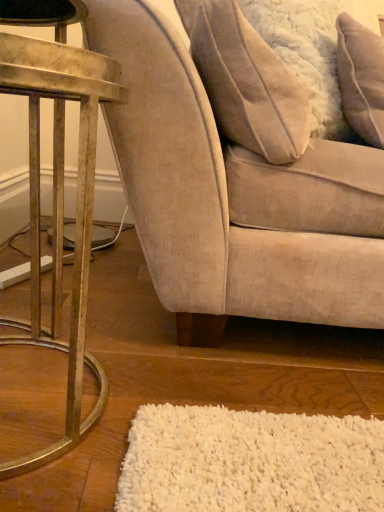
Question: Does white fluffy pillow at upper right, the second pillow from the left, have a larger size compared to beige fabric pillow at upper right, positioned as the 1th pillow in left-to-right order?

Choices:
 (A) yes
 (B) no

Answer: (B)

Question: Does white fluffy pillow at upper right, the second pillow from the left, have a lesser width compared to beige fabric pillow at upper right, which is counted as the 2th pillow, starting from the right?

Choices:
 (A) yes
 (B) no

Answer: (A)

Question: Is white fluffy pillow at upper right, the first pillow in the right-to-left sequence, smaller than beige fabric pillow at upper right, positioned as the 1th pillow in left-to-right order?

Choices:
 (A) yes
 (B) no

Answer: (A)

Question: Is white fluffy pillow at upper right, the second pillow from the left, behind beige fabric pillow at upper right, positioned as the 1th pillow in left-to-right order?

Choices:
 (A) no
 (B) yes

Answer: (B)

Question: Does white fluffy pillow at upper right, the first pillow in the right-to-left sequence, turn towards beige fabric pillow at upper right, which is counted as the 2th pillow, starting from the right?

Choices:
 (A) yes
 (B) no

Answer: (B)

Question: From a real-world perspective, relative to beige fabric pillow at upper right, which is counted as the 2th pillow, starting from the right, is metallic gold table at left vertically above or below?

Choices:
 (A) below
 (B) above

Answer: (A)

Question: Based on their sizes in the image, would you say metallic gold table at left is bigger or smaller than beige fabric pillow at upper right, positioned as the 1th pillow in left-to-right order?

Choices:
 (A) small
 (B) big

Answer: (A)

Question: In terms of height, does metallic gold table at left look taller or shorter compared to beige fabric pillow at upper right, positioned as the 1th pillow in left-to-right order?

Choices:
 (A) short
 (B) tall

Answer: (B)

Question: From the image's perspective, relative to beige fabric pillow at upper right, positioned as the 1th pillow in left-to-right order, is metallic gold table at left above or below?

Choices:
 (A) above
 (B) below

Answer: (B)

Question: Is point (258, 61) positioned closer to the camera than point (51, 328)?

Choices:
 (A) closer
 (B) farther

Answer: (A)

Question: Is beige fabric chair at center to the left or to the right of metallic gold table at left in the image?

Choices:
 (A) right
 (B) left

Answer: (A)

Question: Considering the positions of beige fabric chair at center and metallic gold table at left in the image, is beige fabric chair at center taller or shorter than metallic gold table at left?

Choices:
 (A) short
 (B) tall

Answer: (B)

Question: From the image's perspective, is beige fabric chair at center positioned above or below metallic gold table at left?

Choices:
 (A) above
 (B) below

Answer: (A)

Question: Based on their sizes in the image, would you say beige fabric pillow at upper right, positioned as the 1th pillow in left-to-right order, is bigger or smaller than metallic gold table at left?

Choices:
 (A) small
 (B) big

Answer: (B)

Question: Is point (x=225, y=67) closer or farther from the camera than point (x=91, y=172)?

Choices:
 (A) closer
 (B) farther

Answer: (B)